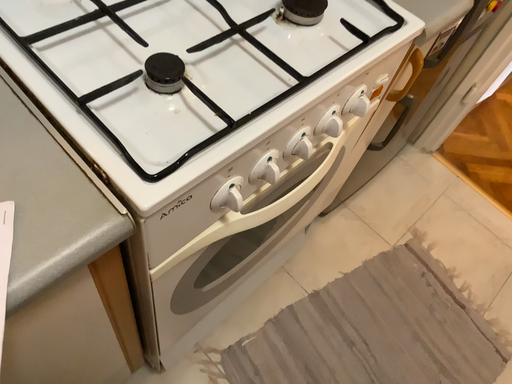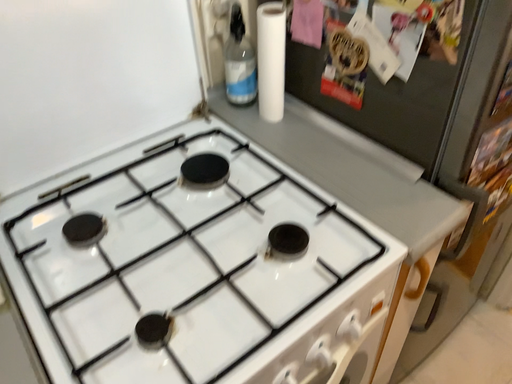
Question: Which way did the camera rotate in the video?

Choices:
 (A) rotated downward
 (B) rotated upward

Answer: (B)